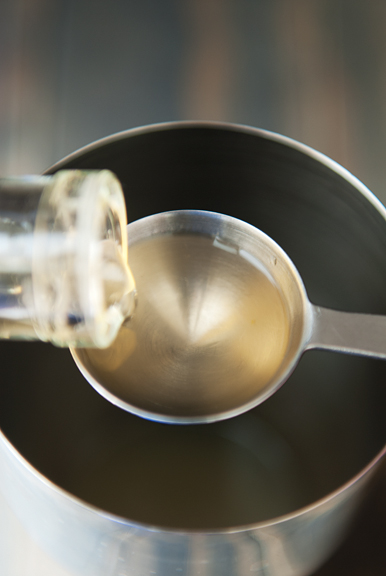
Locate an element on the screen. rim of measuring spoon is located at coordinates (111, 399).